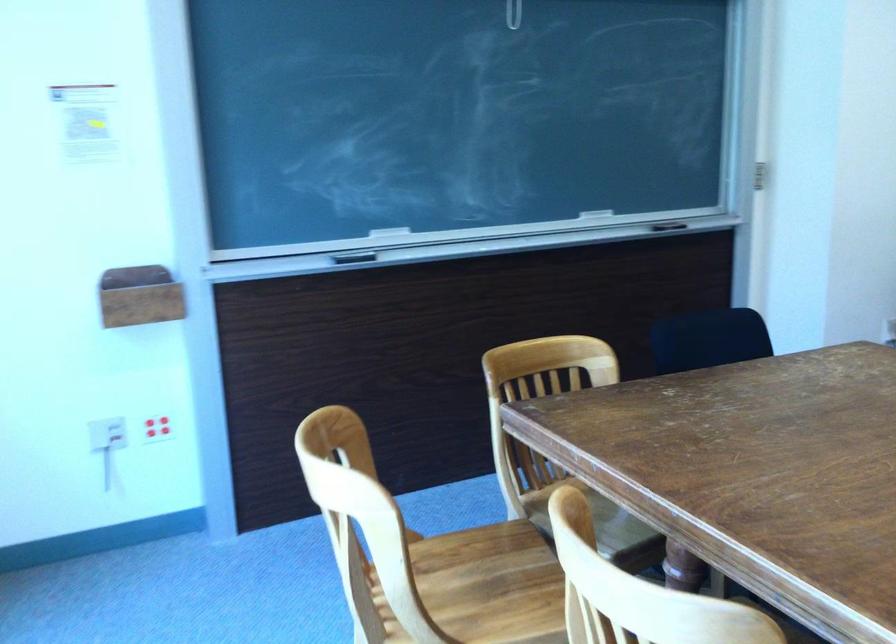
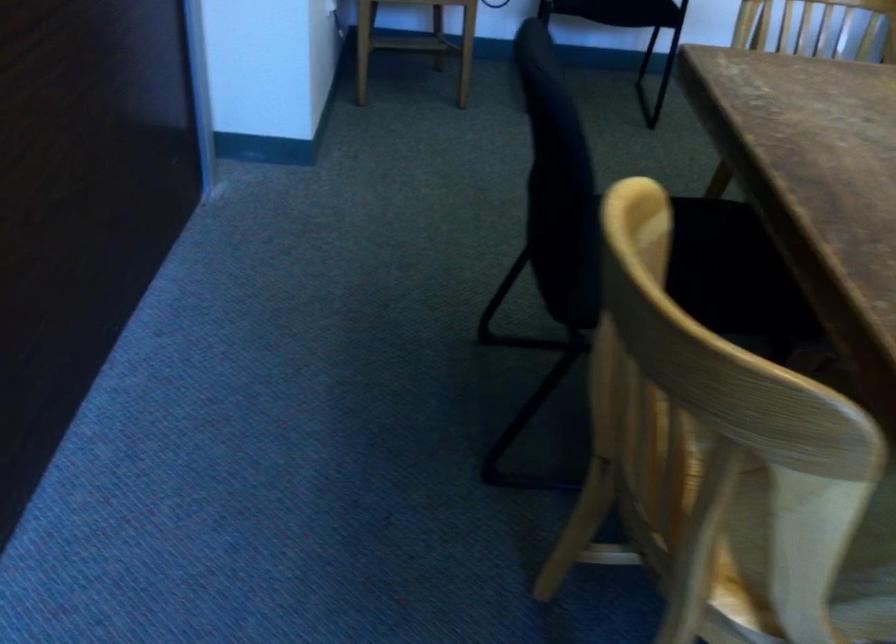
Locate, in the second image, the point that corresponds to pixel 605 525 in the first image.

(872, 538)